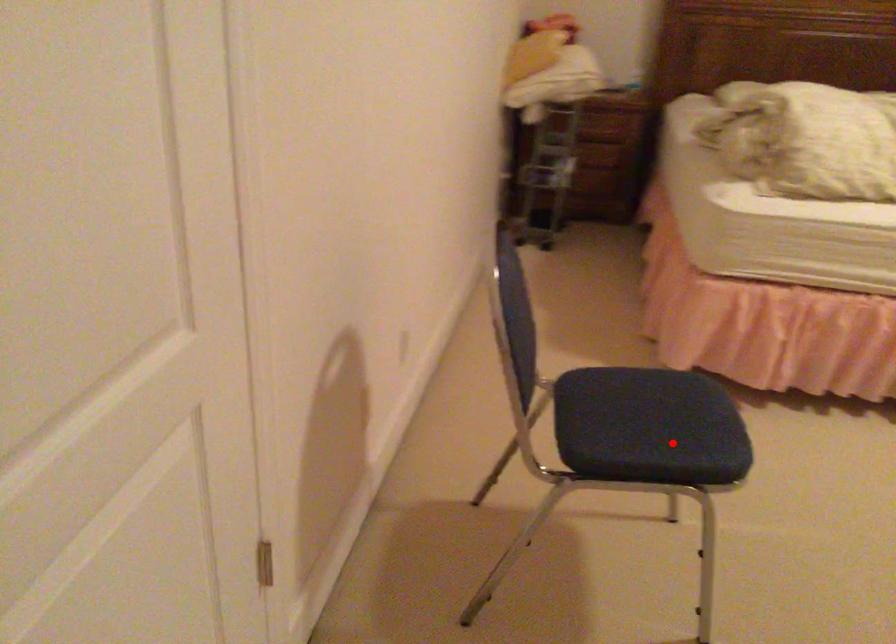
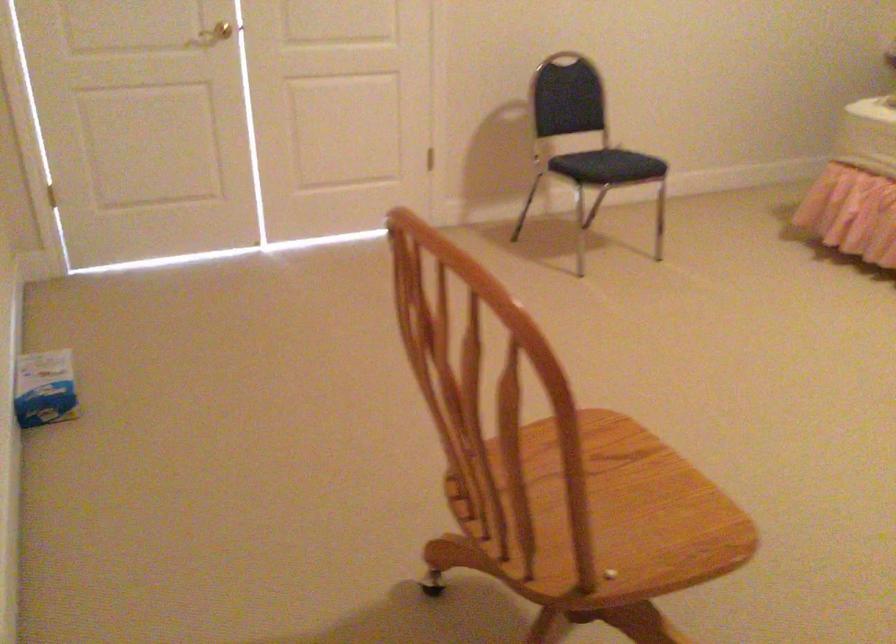
Find the pixel in the second image that matches the highlighted location in the first image.

(607, 166)